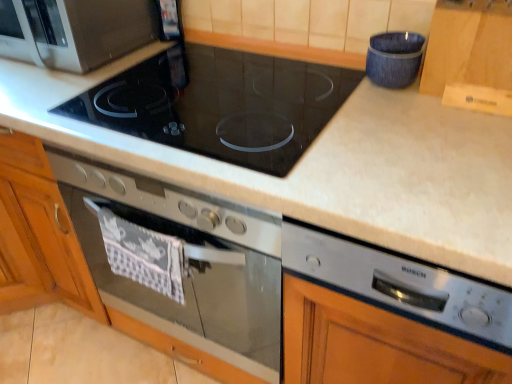
Locate an element on the screen. The height and width of the screenshot is (384, 512). vacant area located to the right-hand side of matte black microwave at upper left is located at coordinates (184, 60).